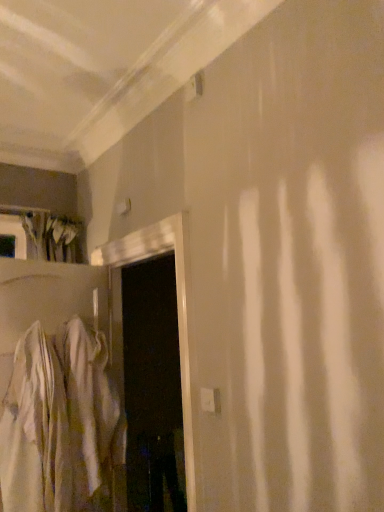
Question: Can you confirm if white glossy door at center is shorter than white cotton robe at left?

Choices:
 (A) yes
 (B) no

Answer: (B)

Question: Is white glossy door at center outside of white cotton robe at left?

Choices:
 (A) no
 (B) yes

Answer: (B)

Question: Is the depth of white glossy door at center less than that of white cotton robe at left?

Choices:
 (A) yes
 (B) no

Answer: (A)

Question: From a real-world perspective, is white glossy door at center positioned under white cotton robe at left based on gravity?

Choices:
 (A) no
 (B) yes

Answer: (A)

Question: Can you confirm if white glossy door at center is taller than white cotton robe at left?

Choices:
 (A) no
 (B) yes

Answer: (B)

Question: Can you confirm if white glossy door at center is thinner than white cotton robe at left?

Choices:
 (A) yes
 (B) no

Answer: (B)

Question: Is white cotton robe at left wider than white glossy door at center?

Choices:
 (A) no
 (B) yes

Answer: (A)

Question: Does white cotton robe at left touch white glossy door at center?

Choices:
 (A) yes
 (B) no

Answer: (B)

Question: Is white cotton robe at left positioned far away from white glossy door at center?

Choices:
 (A) no
 (B) yes

Answer: (A)

Question: From the image's perspective, is white cotton robe at left over white glossy door at center?

Choices:
 (A) no
 (B) yes

Answer: (A)

Question: Is white cotton robe at left further to the viewer compared to white glossy door at center?

Choices:
 (A) no
 (B) yes

Answer: (B)

Question: Does white cotton robe at left lie in front of white glossy door at center?

Choices:
 (A) no
 (B) yes

Answer: (A)

Question: From a real-world perspective, is white glossy door at center above or below white cotton robe at left?

Choices:
 (A) below
 (B) above

Answer: (B)